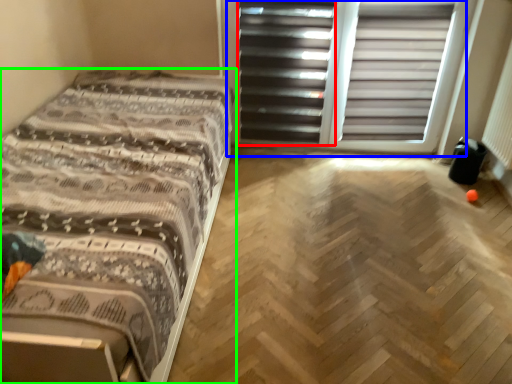
Question: Which object is positioned farthest from screen door (highlighted by a red box)? Select from screen door (highlighted by a blue box) and bed (highlighted by a green box).

Choices:
 (A) screen door
 (B) bed

Answer: (B)